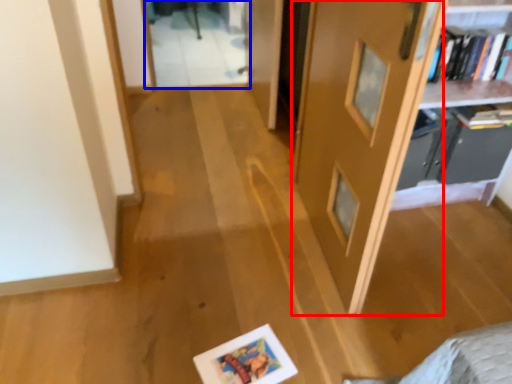
Question: Which object appears closest to the camera in this image, door (highlighted by a red box) or glass door (highlighted by a blue box)?

Choices:
 (A) door
 (B) glass door

Answer: (A)